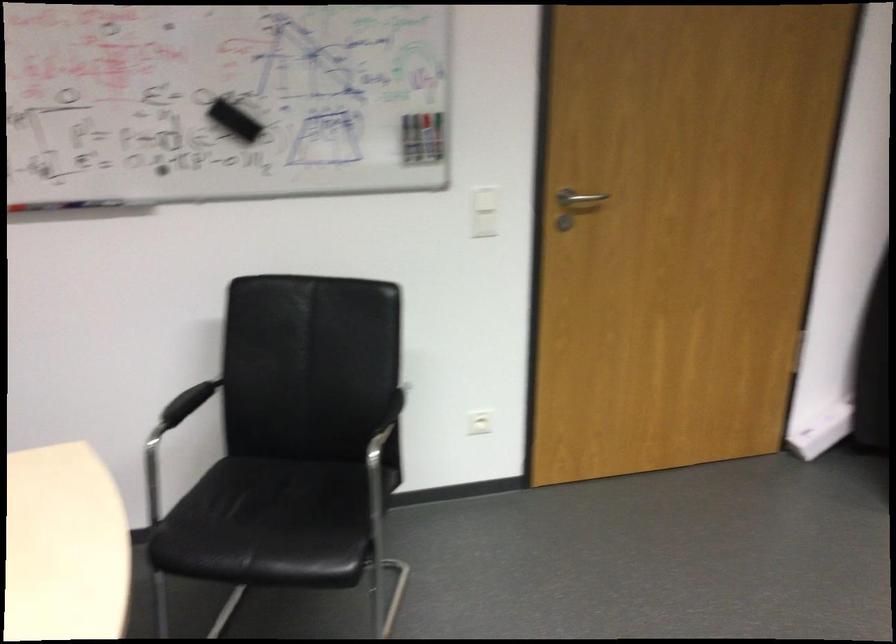
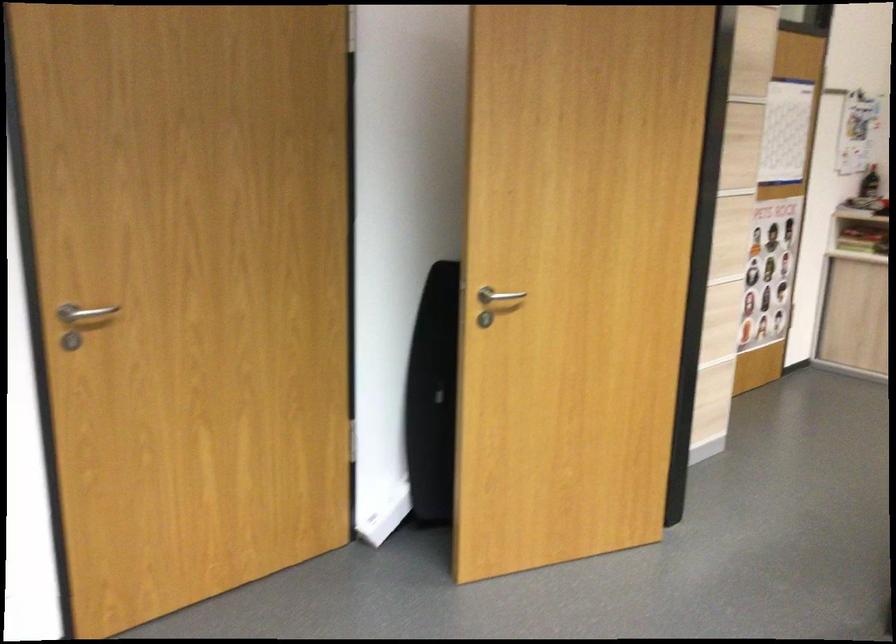
Question: The images are taken continuously from a first-person perspective. In which direction is your viewpoint rotating?

Choices:
 (A) Left
 (B) Right
 (C) Up
 (D) Down

Answer: (B)